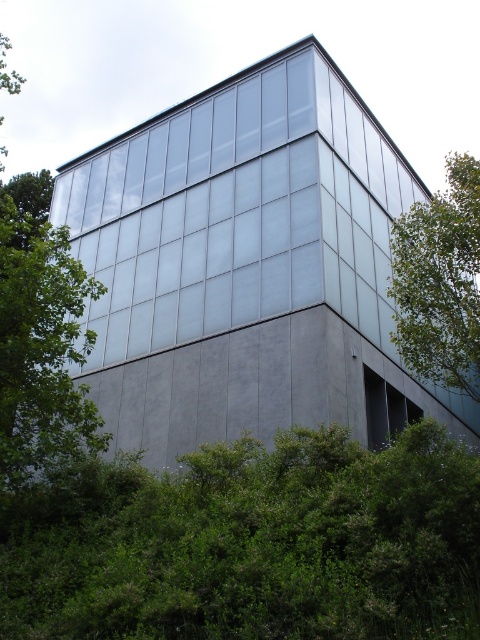
Question: Does green leafy tree at right have a lesser width compared to transparent glass window at center?

Choices:
 (A) yes
 (B) no

Answer: (B)

Question: Which of the following is the farthest from the observer?

Choices:
 (A) green leafy tree at right
 (B) green leafy bush at lower center
 (C) transparent glass window at center

Answer: (C)

Question: Which point is farther to the camera?

Choices:
 (A) green leafy tree at right
 (B) green leafy bush at lower center

Answer: (A)

Question: Is green leafy tree at left to the left of transparent glass window at center from the viewer's perspective?

Choices:
 (A) yes
 (B) no

Answer: (A)

Question: Is green leafy bush at lower center smaller than green leafy tree at left?

Choices:
 (A) yes
 (B) no

Answer: (A)

Question: Among these objects, which one is nearest to the camera?

Choices:
 (A) green leafy bush at lower center
 (B) green leafy tree at right
 (C) transparent glass window at center

Answer: (A)